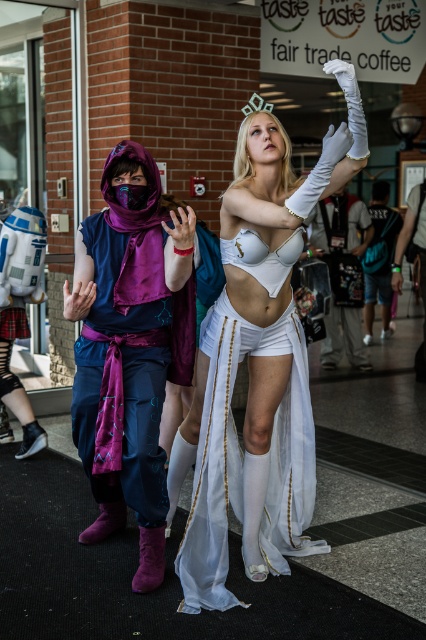
Who is taller, white satin dress at center or purple velvet scarf at left?

white satin dress at center

Between white satin dress at center and purple velvet scarf at left, which one appears on the right side from the viewer's perspective?

From the viewer's perspective, white satin dress at center appears more on the right side.

Locate an element on the screen. The image size is (426, 640). white satin dress at center is located at coordinates (256, 365).